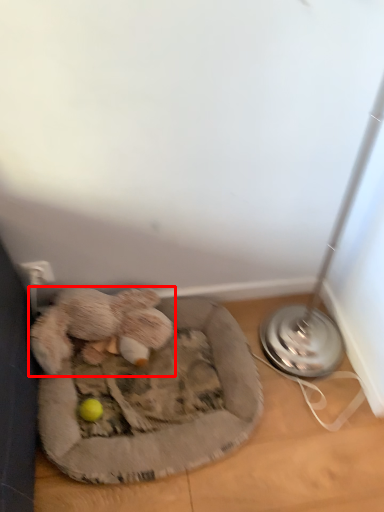
Question: From the image's perspective, considering the relative positions of toy (annotated by the red box) and dog bed in the image provided, where is toy (annotated by the red box) located with respect to the staircase?

Choices:
 (A) below
 (B) above

Answer: (B)